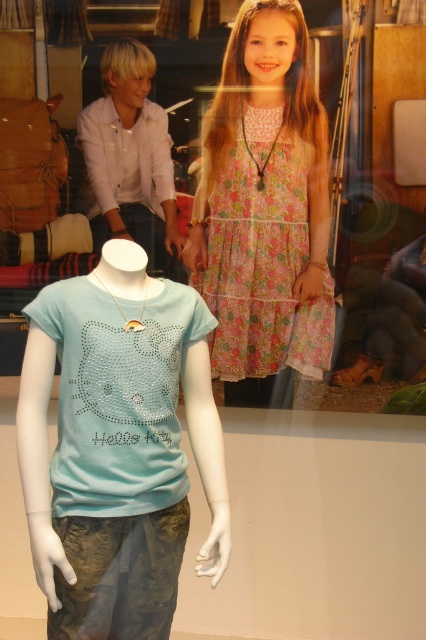
Which is behind, point (414, 220) or point (150, 490)?

The point (414, 220) is more distant.

Is light blue jersey at center wider than light blue fabric hello kitty shirt at center?

Correct, the width of light blue jersey at center exceeds that of light blue fabric hello kitty shirt at center.

This screenshot has width=426, height=640. Find the location of `light blue jersey at center`. light blue jersey at center is located at coordinates (305, 220).

What are the coordinates of `light blue jersey at center` in the screenshot? It's located at (305, 220).

At what (x,y) coordinates should I click in order to perform the action: click on light blue fabric hello kitty shirt at center. Please return your answer as a coordinate pair (x, y). Looking at the image, I should click on (118, 436).

Is light blue fabric hello kitty shirt at center below floral cotton dress at upper center?

Indeed, light blue fabric hello kitty shirt at center is positioned under floral cotton dress at upper center.

Describe the element at coordinates (118, 436) in the screenshot. This screenshot has height=640, width=426. I see `light blue fabric hello kitty shirt at center` at that location.

The height and width of the screenshot is (640, 426). Find the location of `light blue fabric hello kitty shirt at center`. light blue fabric hello kitty shirt at center is located at coordinates (118, 436).

Does light blue jersey at center lie in front of floral cotton dress at upper center?

Yes, light blue jersey at center is in front of floral cotton dress at upper center.

Between light blue jersey at center and floral cotton dress at upper center, which one appears on the left side from the viewer's perspective?

light blue jersey at center

Which is behind, point (396, 298) or point (285, 202)?

The point (396, 298) is behind.

At what (x,y) coordinates should I click in order to perform the action: click on light blue jersey at center. Please return your answer as a coordinate pair (x, y). The image size is (426, 640). Looking at the image, I should click on (305, 220).